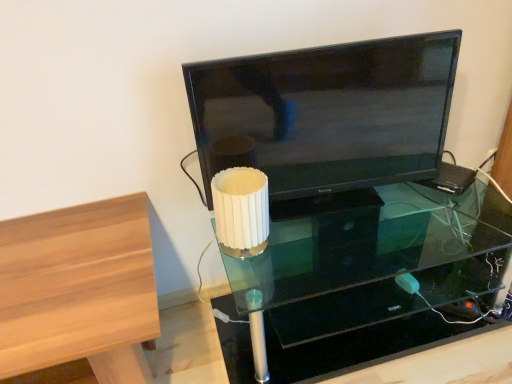
Question: Is light brown wood table at left shorter than matte black tv at center?

Choices:
 (A) no
 (B) yes

Answer: (A)

Question: Is light brown wood table at left smaller than matte black tv at center?

Choices:
 (A) yes
 (B) no

Answer: (B)

Question: Is light brown wood table at left in front of matte black tv at center?

Choices:
 (A) no
 (B) yes

Answer: (B)

Question: From a real-world perspective, is light brown wood table at left positioned under matte black tv at center based on gravity?

Choices:
 (A) yes
 (B) no

Answer: (A)

Question: Can you confirm if light brown wood table at left is taller than matte black tv at center?

Choices:
 (A) no
 (B) yes

Answer: (B)

Question: Is the surface of light brown wood table at left in direct contact with matte black tv at center?

Choices:
 (A) no
 (B) yes

Answer: (A)

Question: Is matte black tv at center outside light brown wood table at left?

Choices:
 (A) no
 (B) yes

Answer: (B)

Question: Considering the relative sizes of matte black tv at center and light brown wood table at left in the image provided, is matte black tv at center shorter than light brown wood table at left?

Choices:
 (A) no
 (B) yes

Answer: (B)

Question: Is matte black tv at center next to light brown wood table at left and touching it?

Choices:
 (A) no
 (B) yes

Answer: (A)

Question: Is matte black tv at center facing towards light brown wood table at left?

Choices:
 (A) yes
 (B) no

Answer: (B)

Question: Does matte black tv at center appear on the right side of light brown wood table at left?

Choices:
 (A) no
 (B) yes

Answer: (B)

Question: Is matte black tv at center turned away from light brown wood table at left?

Choices:
 (A) yes
 (B) no

Answer: (B)

Question: Is transparent glass table at center at the back of matte black tv at center?

Choices:
 (A) no
 (B) yes

Answer: (A)